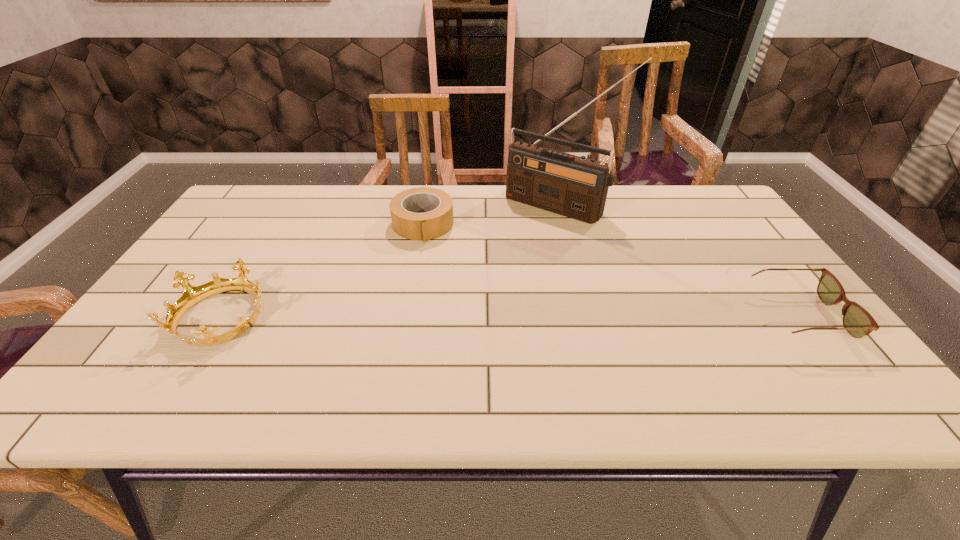
I want to click on object that is at the near right corner, so tap(857, 321).

Image resolution: width=960 pixels, height=540 pixels. What are the coordinates of `vacant space at the far edge` in the screenshot? It's located at (642, 217).

Image resolution: width=960 pixels, height=540 pixels. Identify the location of vacant region at the near edge of the desktop. (588, 357).

In the image, there is a desktop. Where is `free region at the right edge`? Image resolution: width=960 pixels, height=540 pixels. free region at the right edge is located at coordinates (797, 293).

The image size is (960, 540). Identify the location of free space at the near left corner. (140, 354).

Where is `free space at the far right corner`? The height and width of the screenshot is (540, 960). free space at the far right corner is located at coordinates (705, 198).

This screenshot has height=540, width=960. What are the coordinates of `blank region between the third shortest object and the duct tape` in the screenshot? It's located at (323, 270).

Where is `vacant space in between the crown and the spectacles`? The image size is (960, 540). vacant space in between the crown and the spectacles is located at coordinates (511, 316).

Find the location of a particular element. The width and height of the screenshot is (960, 540). free space between the spectacles and the crown is located at coordinates (511, 316).

This screenshot has width=960, height=540. I want to click on vacant area that lies between the spectacles and the leftmost object, so tap(511, 316).